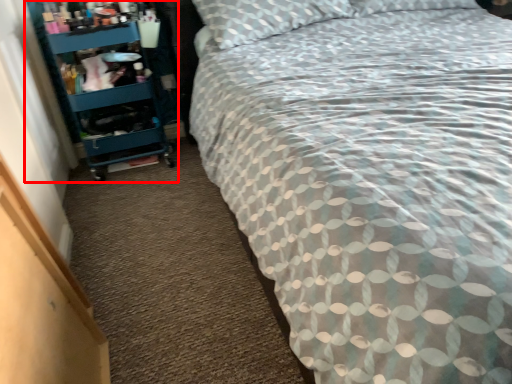
Question: From the image's perspective, what is the correct spatial positioning of shelf (annotated by the red box) in reference to bed?

Choices:
 (A) below
 (B) above

Answer: (B)